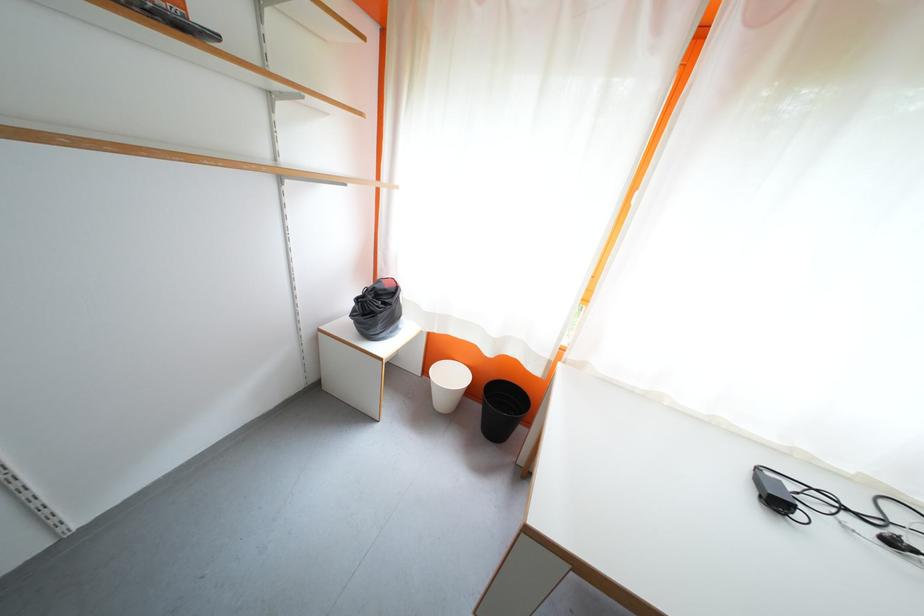
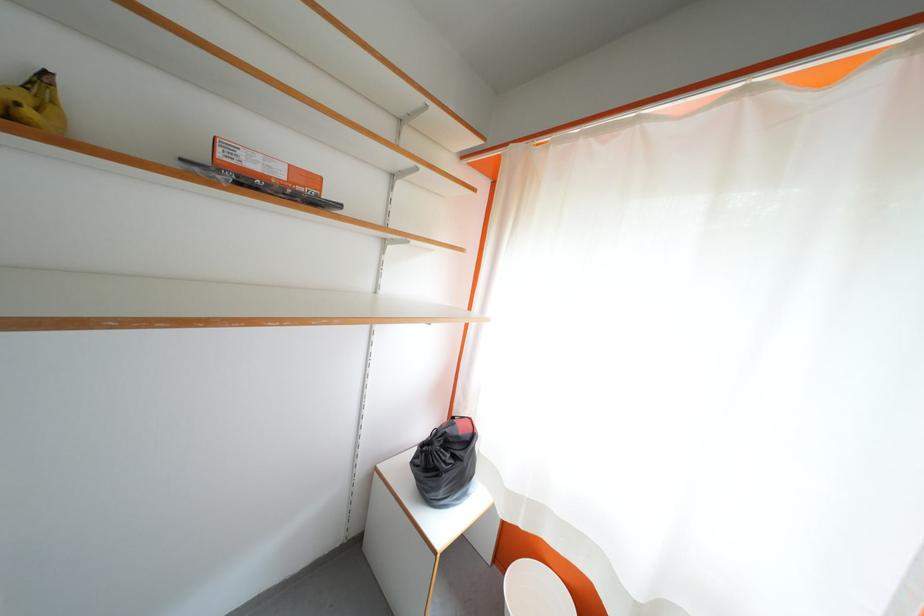
Locate, in the second image, the point that corresponds to the point at 386,310 in the first image.

(455, 460)